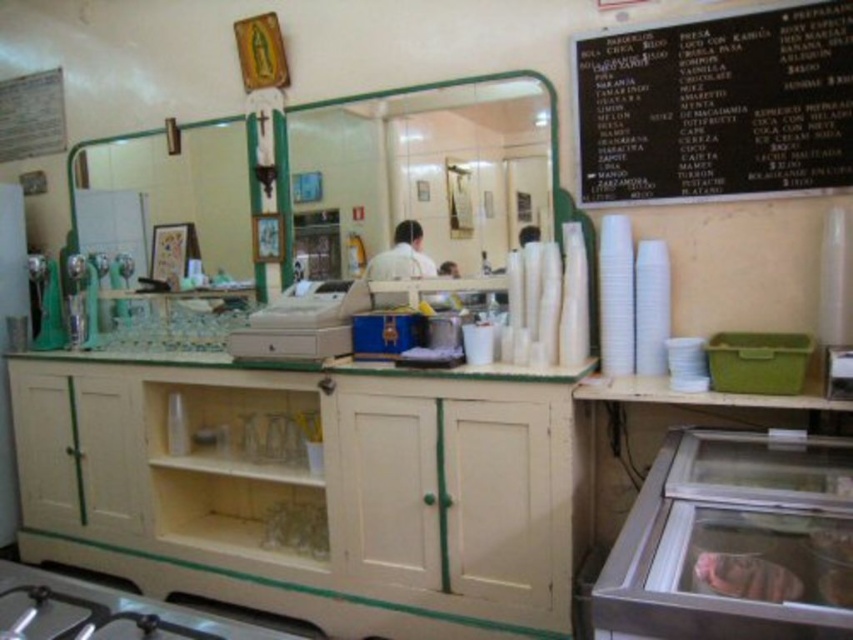
Question: Considering the relative positions of black chalkboard at upper right and white matte shirt at center in the image provided, where is black chalkboard at upper right located with respect to white matte shirt at center?

Choices:
 (A) below
 (B) above

Answer: (B)

Question: From the image, what is the correct spatial relationship of black chalkboard at upper right in relation to transparent glass display case at lower right?

Choices:
 (A) right
 (B) left

Answer: (A)

Question: Which object appears farthest from the camera in this image?

Choices:
 (A) white matte shirt at center
 (B) black chalkboard at upper right
 (C) transparent glass display case at lower right

Answer: (A)

Question: Which object is the farthest from the transparent glass display case at lower right?

Choices:
 (A) black chalkboard at upper right
 (B) white matte shirt at center

Answer: (B)

Question: Which point is farther to the camera?

Choices:
 (A) black chalkboard at upper right
 (B) white matte shirt at center

Answer: (B)

Question: Is transparent glass display case at lower right thinner than white matte shirt at center?

Choices:
 (A) yes
 (B) no

Answer: (B)